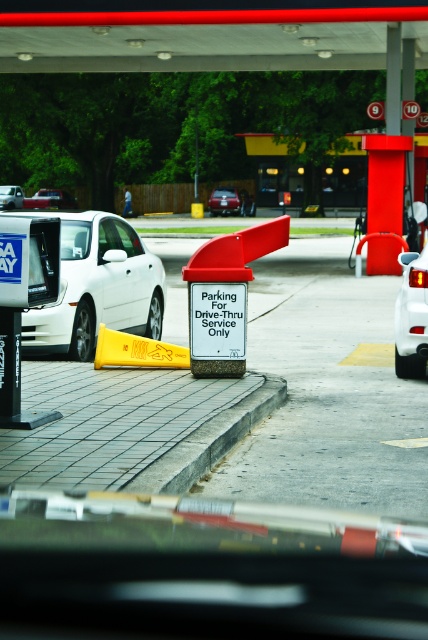
You are driving a car that is 15 feet long. You want to park between the gray concrete curb at lower center and the white matte car at right. Is there enough space for your car?

The distance between the gray concrete curb at lower center and the white matte car at right is 9.41 feet, which is shorter than your car length of 15 feet. Therefore, there is not enough space to park your car between them.

You are a delivery driver who needs to park your vehicle in the drive thru area. You see the gray concrete curb at lower center and the matte white sedan at center. Which one has a greater width?

The gray concrete curb at lower center has a greater width than the matte white sedan at center.